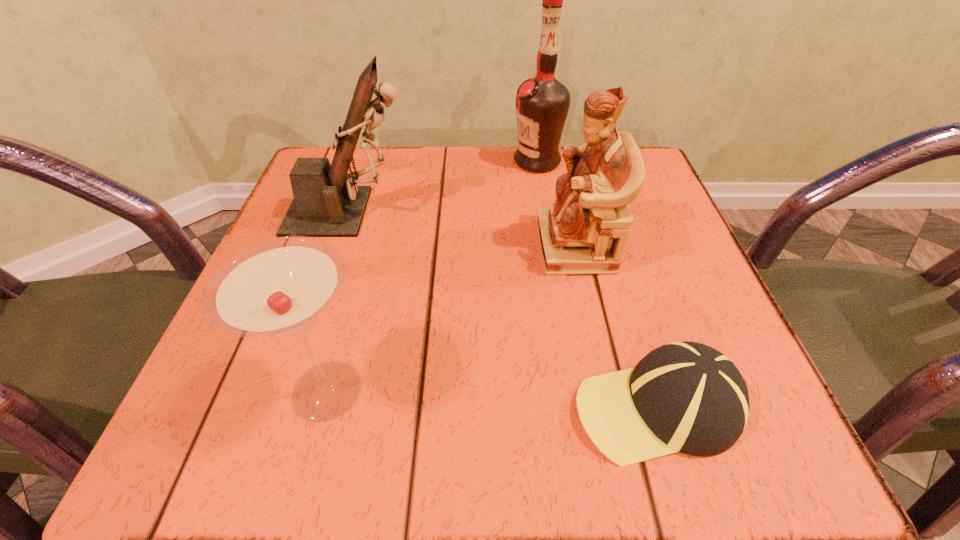
Where is `free space located 0.140m on the front-facing side of the right figurine`? free space located 0.140m on the front-facing side of the right figurine is located at coordinates pyautogui.click(x=461, y=246).

This screenshot has height=540, width=960. I want to click on vacant space situated 0.120m on the front-facing side of the right figurine, so click(x=471, y=246).

The height and width of the screenshot is (540, 960). Identify the location of vacant space situated on the right of the fourth tallest object. (597, 390).

In order to click on blank space located with the brim of the baseball cap facing forward in this screenshot , I will do `click(450, 407)`.

The image size is (960, 540). What are the coordinates of `free space located with the brim of the baseball cap facing forward` in the screenshot? It's located at (427, 407).

Find the location of `free space located with the brim of the baseball cap facing forward`. free space located with the brim of the baseball cap facing forward is located at coordinates (435, 407).

Identify the location of liquor that is positioned at the far edge. The width and height of the screenshot is (960, 540). (542, 103).

This screenshot has width=960, height=540. Identify the location of figurine located in the far edge section of the desktop. pyautogui.click(x=327, y=202).

Where is `martini situated at the near edge`? This screenshot has width=960, height=540. martini situated at the near edge is located at coordinates (279, 288).

Identify the location of baseball cap that is at the near edge. The image size is (960, 540). (687, 397).